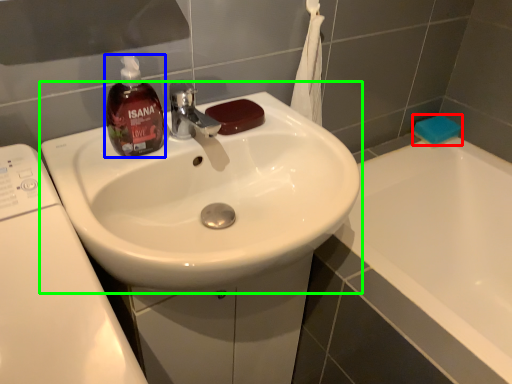
Question: Estimate the real-world distances between objects in this image. Which object is farther from soap (highlighted by a red box), bottle (highlighted by a blue box) or sink (highlighted by a green box)?

Choices:
 (A) bottle
 (B) sink

Answer: (A)